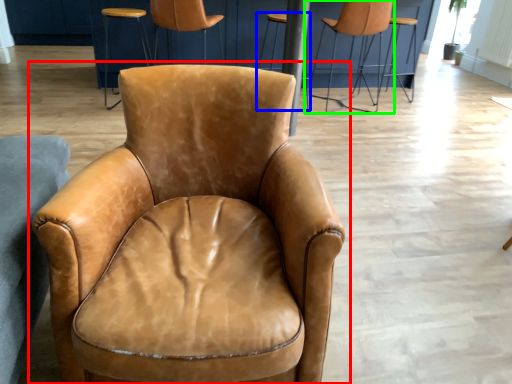
Question: Based on their relative distances, which object is nearer to chair (highlighted by a red box)? Choose from bar stool (highlighted by a blue box) and chair (highlighted by a green box).

Choices:
 (A) bar stool
 (B) chair

Answer: (A)